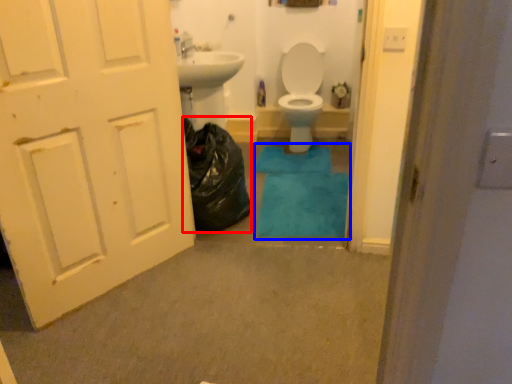
Question: Which object is closer to the camera taking this photo, garbage (highlighted by a red box) or bath mat (highlighted by a blue box)?

Choices:
 (A) garbage
 (B) bath mat

Answer: (A)